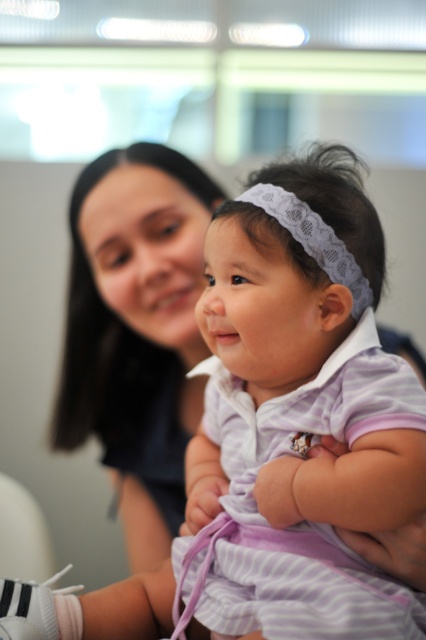
You are a photographer trying to capture a closeup of the baby in this scene. You need to focus on either the purple striped dress at center or the white lace headband at center. Which object is closer to the camera, and why?

The purple striped dress at center and white lace headband at center are 6.24 inches apart from each other. Since both objects are at the same center position, their distance to the camera is equal, so neither is closer. However, if the dress is part of the baby and the headband is on the baby, they share the same focal plane.